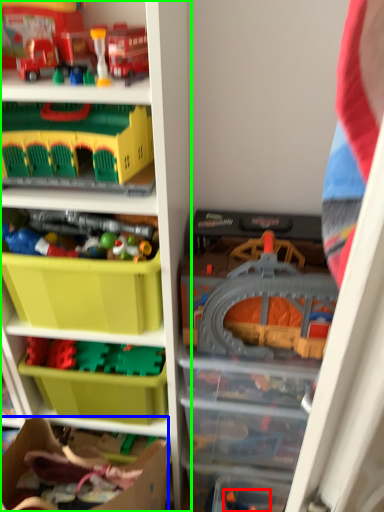
Question: Estimate the real-world distances between objects in this image. Which object is farther from toy (highlighted by a red box), cardboard box (highlighted by a blue box) or shelf (highlighted by a green box)?

Choices:
 (A) cardboard box
 (B) shelf

Answer: (B)